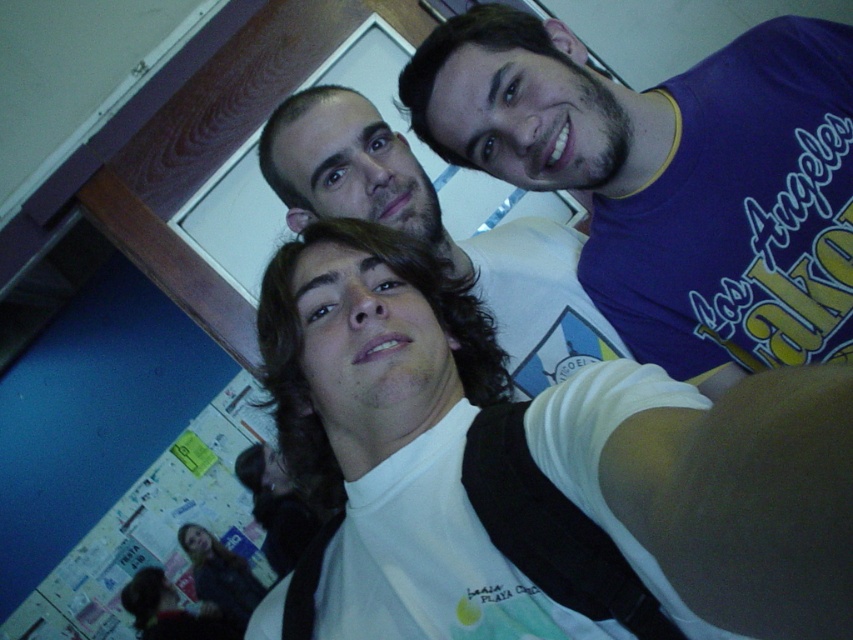
Question: Which point is farther from the camera taking this photo?

Choices:
 (A) (276, 186)
 (B) (144, 628)
 (C) (773, 150)

Answer: (B)

Question: Which of the following is the closest to the observer?

Choices:
 (A) (202, 545)
 (B) (561, 160)

Answer: (B)

Question: Is the position of white matte t-shirt at upper right less distant than that of dark brown hair at lower left?

Choices:
 (A) yes
 (B) no

Answer: (A)

Question: Can you confirm if smooth black hair at lower left is positioned above dark brown hair at lower left?

Choices:
 (A) yes
 (B) no

Answer: (A)

Question: Where is white matte t-shirt at upper right located in relation to white matte shirt at center in the image?

Choices:
 (A) right
 (B) left

Answer: (A)

Question: Which point is closer to the camera?

Choices:
 (A) (132, 609)
 (B) (210, 536)

Answer: (A)